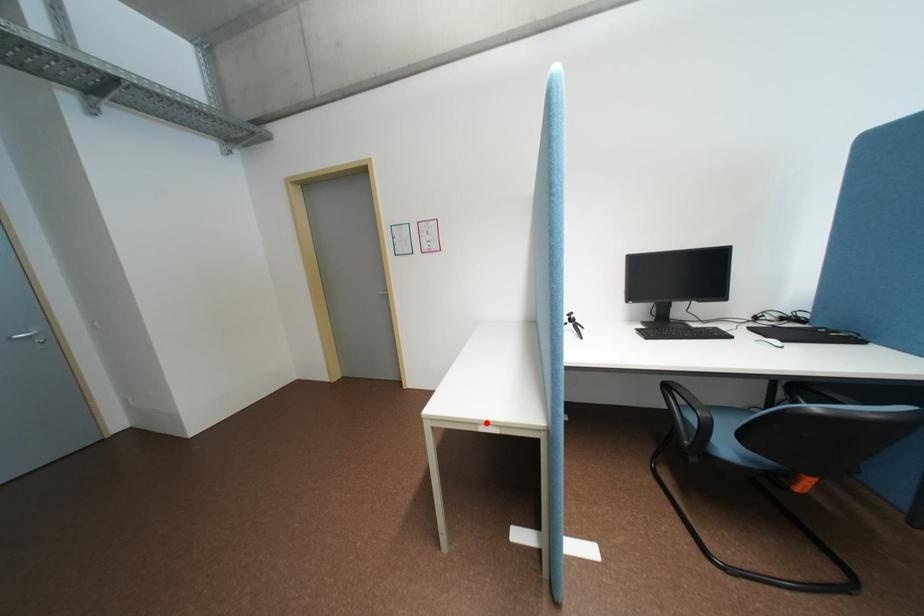
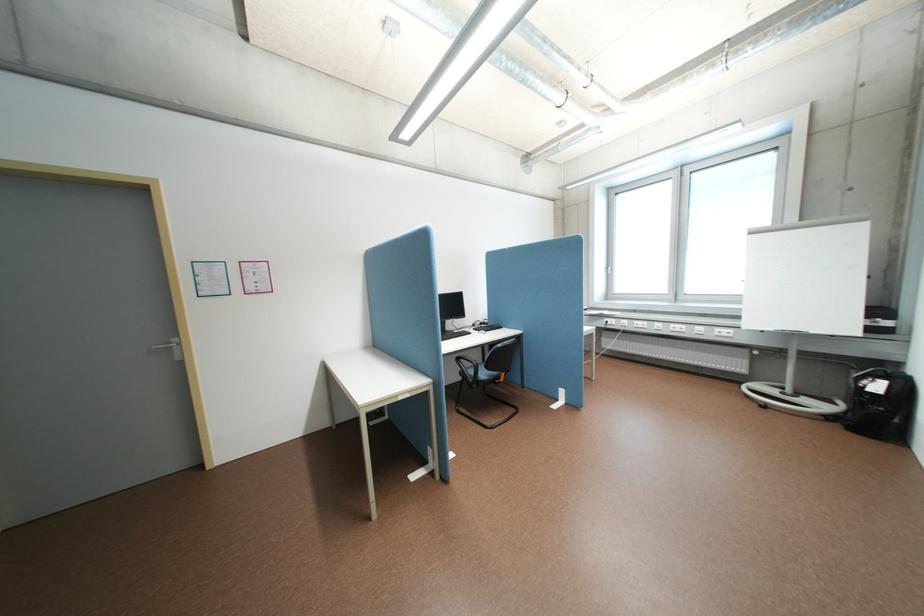
In the second image, find the point that corresponds to the highlighted location in the first image.

(407, 395)